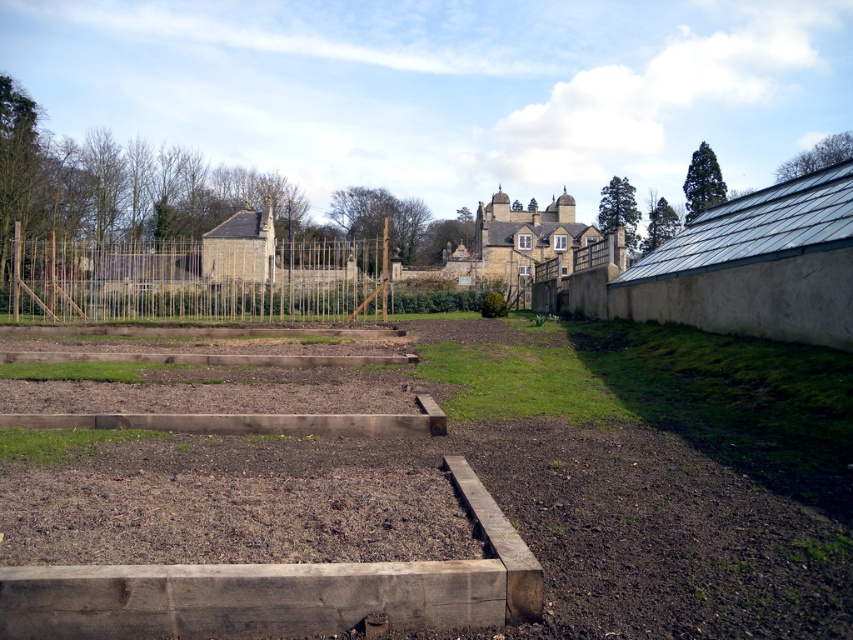
Question: Can you confirm if brown wooden raised beds at center is thinner than wooden fence at center?

Choices:
 (A) no
 (B) yes

Answer: (B)

Question: Does brown wooden raised beds at center appear on the right side of wooden fence at center?

Choices:
 (A) no
 (B) yes

Answer: (B)

Question: Is brown wooden raised beds at center closer to the viewer compared to wooden fence at center?

Choices:
 (A) no
 (B) yes

Answer: (B)

Question: Which object is farther from the camera taking this photo?

Choices:
 (A) wooden fence at center
 (B) brown wooden raised beds at center

Answer: (A)

Question: Which object is farther from the camera taking this photo?

Choices:
 (A) wooden fence at center
 (B) brown wooden raised beds at center

Answer: (A)